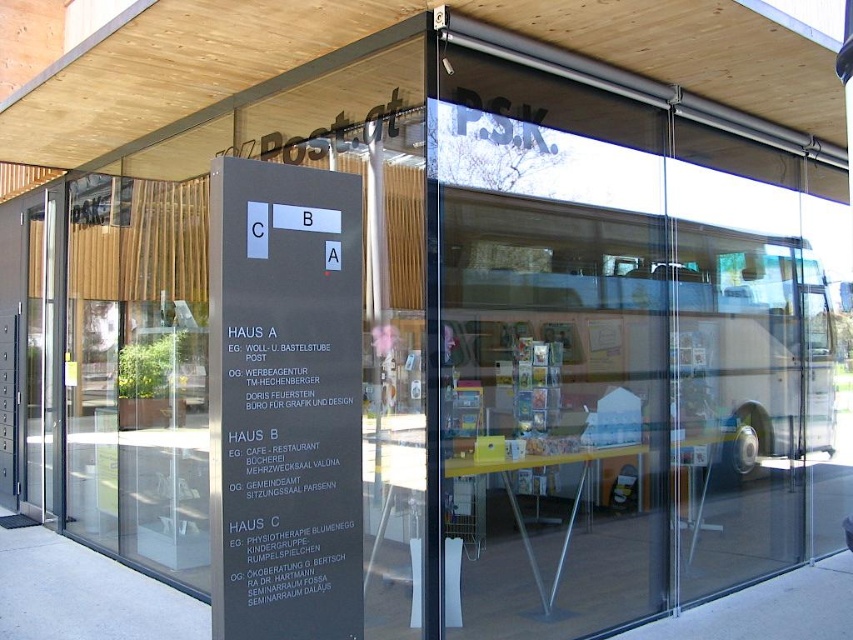
You are a visitor arriving at the building and need to enter through the entrance. You see the transparent glass door at left and the black matte sign at center. Which object is smaller in size?

The transparent glass door at left occupies less space than the black matte sign at center, so the transparent glass door at left is smaller in size.

Okay, let me try to tackle this. First, I need to understand the given information. The scene is the entrance of a modern building with glass doors and a signpost labeled HAUS A, B, C. The objects listed are a point at coordinates (103,252), and the description says it is 29.14 feet away from the viewer. The user wants me to generate a question and answer based on the rules. The question must mention both objects from the Objects list. Wait, the Objects here only have one entry though? Wait, let m

Wait, looking back at the input provided by the user, the Objects section says